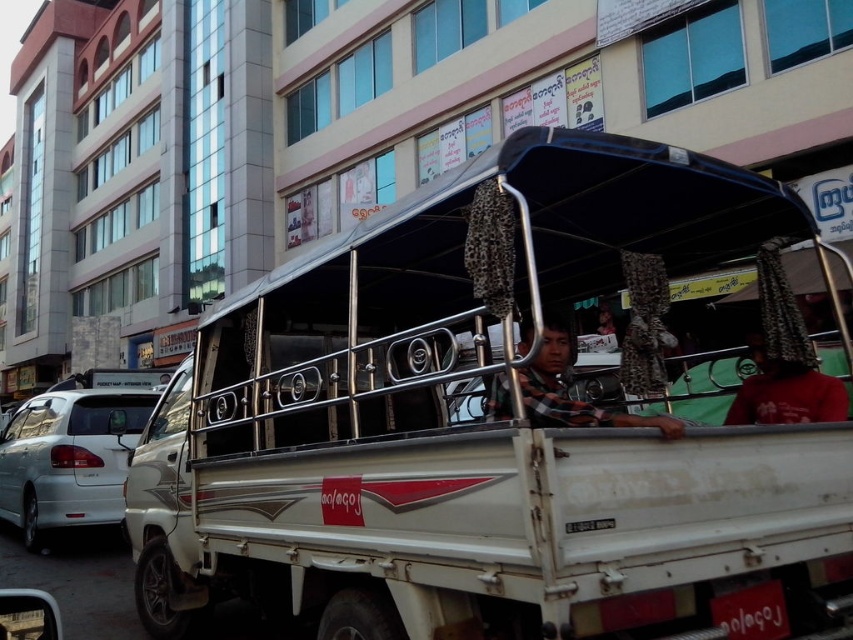
Question: Which point is farther from the camera taking this photo?

Choices:
 (A) (672, 429)
 (B) (457, 285)

Answer: (B)

Question: Among these points, which one is farthest from the camera?

Choices:
 (A) (764, 620)
 (B) (117, 445)

Answer: (B)

Question: Is checkered fabric shirt at center positioned before white plastic license plate at lower right?

Choices:
 (A) yes
 (B) no

Answer: (A)

Question: Can you confirm if white matte truck at center is bigger than checkered fabric shirt at center?

Choices:
 (A) no
 (B) yes

Answer: (B)

Question: Which of the following is the farthest from the observer?

Choices:
 (A) checkered fabric shirt at center
 (B) white matte car at left
 (C) white plastic license plate at lower right
 (D) white matte truck at center

Answer: (B)

Question: Observing the image, what is the correct spatial positioning of white matte car at left in reference to checkered fabric shirt at center?

Choices:
 (A) right
 (B) left

Answer: (B)